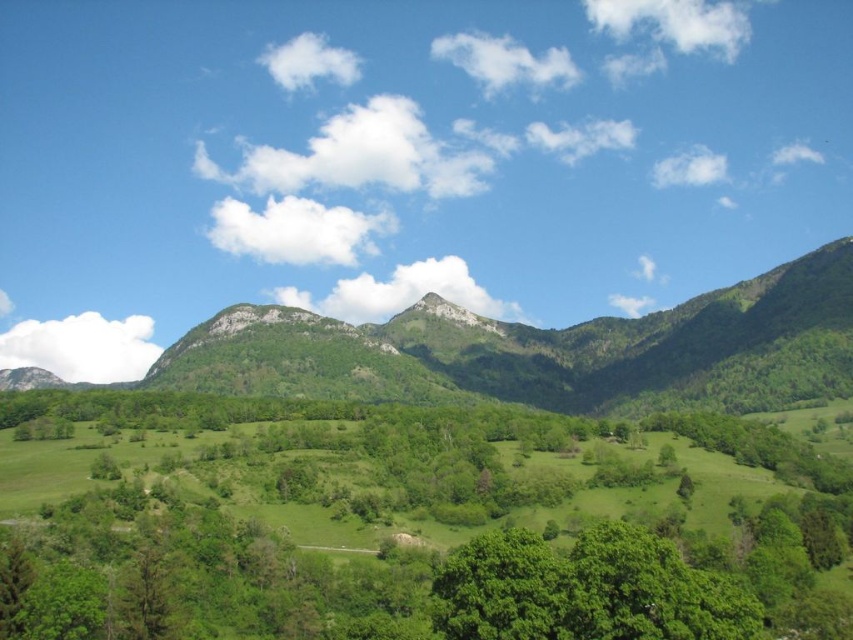
You are an environmental scientist studying the landscape. You observe the green leafy tree at center and the green leafy mountain at center. Which object appears closer to you based on their sizes in the image?

The green leafy tree at center appears closer because it is smaller than the green leafy mountain at center, and smaller objects in the foreground often appear closer in perspective.

You are an environmental researcher analyzing the landscape. You observe the green leafy tree at center and the green leafy mountain at center. Which object appears narrower in the image?

The green leafy tree at center appears narrower than the green leafy mountain at center because it has a lesser width compared to the mountain.

You are standing at the edge of the forest and see the green leafy tree at center and the green leafy mountain at center. Which one is positioned to the right side?

The green leafy tree at center is positioned to the right of the green leafy mountain at center.